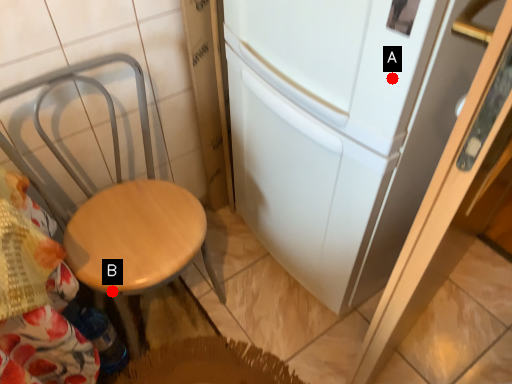
Question: Two points are circled on the image, labeled by A and B beside each circle. Which point appears closest to the camera in this image?

Choices:
 (A) A is closer
 (B) B is closer

Answer: (A)